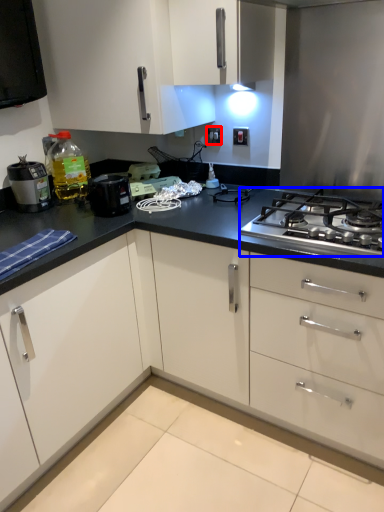
Question: Which point is further to the camera, electric outlet (highlighted by a red box) or gas stove (highlighted by a blue box)?

Choices:
 (A) electric outlet
 (B) gas stove

Answer: (A)